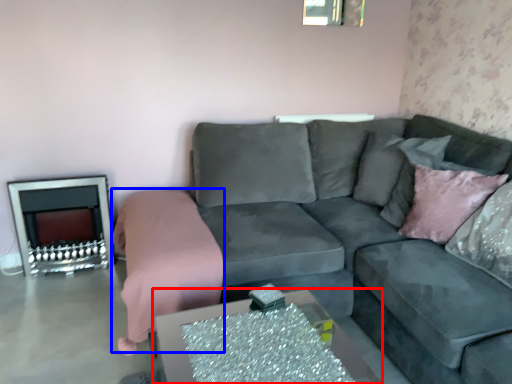
Question: Which object is further to the camera taking this photo, table (highlighted by a red box) or bedding (highlighted by a blue box)?

Choices:
 (A) table
 (B) bedding

Answer: (B)